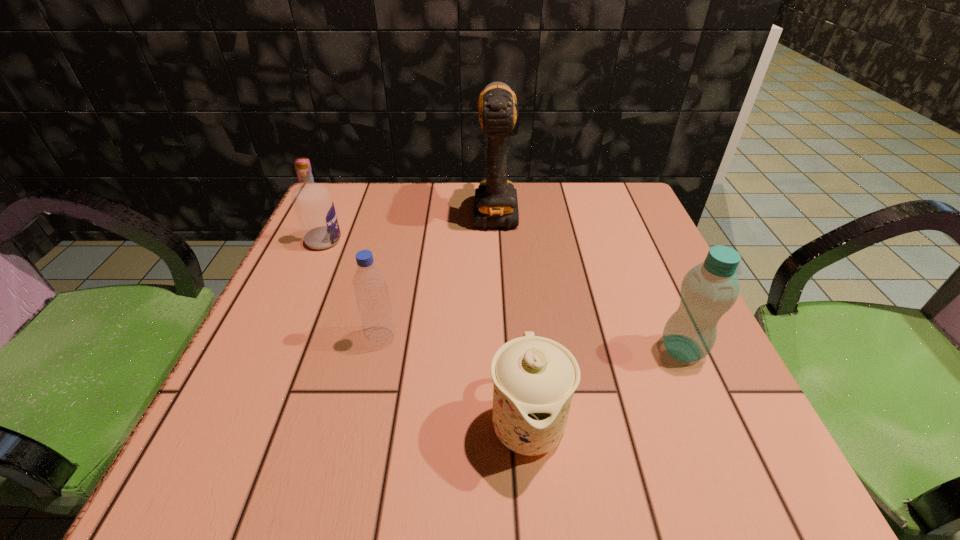
Find the location of a particular element. blank region between the right bottle and the drill is located at coordinates (589, 278).

This screenshot has height=540, width=960. What are the coordinates of `free space between the left bottle and the nearest object` in the screenshot? It's located at (454, 380).

Identify the location of vacant area that lies between the rightmost object and the drill. (589, 278).

At what (x,y) coordinates should I click in order to perform the action: click on vacant space that is in between the vodka and the tallest object. Please return your answer as a coordinate pair (x, y). The width and height of the screenshot is (960, 540). Looking at the image, I should click on (410, 223).

The height and width of the screenshot is (540, 960). I want to click on vacant point located between the tallest object and the chinaware, so click(512, 314).

At what (x,y) coordinates should I click in order to perform the action: click on free spot between the leftmost object and the tallest object. Please return your answer as a coordinate pair (x, y). This screenshot has width=960, height=540. Looking at the image, I should click on (410, 223).

Image resolution: width=960 pixels, height=540 pixels. Identify the location of unoccupied position between the drill and the vodka. (410, 223).

Find the location of `free spot between the leftmost object and the second object from left to right`. free spot between the leftmost object and the second object from left to right is located at coordinates (352, 289).

Identify the location of free space that is in between the nearest object and the rightmost object. This screenshot has width=960, height=540. (605, 386).

This screenshot has width=960, height=540. Identify the location of object identified as the second closest to the right bottle. (496, 205).